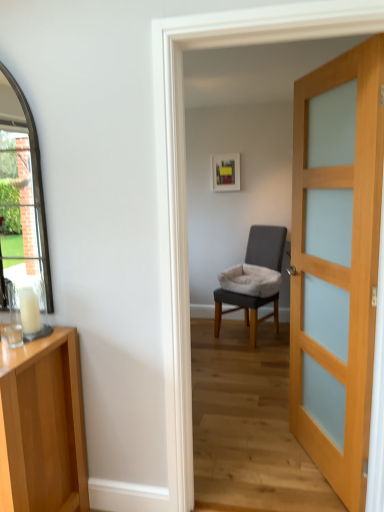
Measure the distance between point (x=339, y=308) and camera.

They are 6.54 feet apart.

Locate an element on the screen. Image resolution: width=384 pixels, height=512 pixels. gray fabric chair at center is located at coordinates (244, 310).

The height and width of the screenshot is (512, 384). Describe the element at coordinates (244, 310) in the screenshot. I see `gray fabric chair at center` at that location.

Identify the location of wooden door at right. (336, 262).

Which is more to the left, wooden door at right or gray fabric chair at center?

From the viewer's perspective, gray fabric chair at center appears more on the left side.

Based on the photo, from a real-world perspective, which object stands above the other?

wooden door at right, from a real-world perspective.

Is wooden door at right beside gray fabric chair at center?

No, wooden door at right is not beside gray fabric chair at center.

Is wooden door at right far from light wood cabinet at left?

Yes, wooden door at right and light wood cabinet at left are located far from each other.

Between wooden door at right and light wood cabinet at left, which one has less height?

light wood cabinet at left is shorter.

Is wooden door at right positioned in front of light wood cabinet at left?

No.

From a real-world perspective, which object stands above the other?

wooden door at right.

Does gray fabric chair at center appear on the left side of light wood cabinet at left?

No.

In terms of width, does gray fabric chair at center look wider or thinner when compared to light wood cabinet at left?

gray fabric chair at center is wider than light wood cabinet at left.

Which is less distant, (272, 251) or (34, 359)?

Point (34, 359)

From a real-world perspective, which is physically above, gray fabric chair at center or light wood cabinet at left?

gray fabric chair at center.

Does light wood cabinet at left have a smaller size compared to wooden door at right?

Actually, light wood cabinet at left might be larger than wooden door at right.

This screenshot has height=512, width=384. What are the coordinates of `door above the light wood cabinet at left (from a real-world perspective)` in the screenshot? It's located at (336, 262).

Is light wood cabinet at left to the left of wooden door at right from the viewer's perspective?

Indeed, light wood cabinet at left is positioned on the left side of wooden door at right.

Is light wood cabinet at left facing away from wooden door at right?

light wood cabinet at left is not turned away from wooden door at right.

Can you confirm if gray fabric chair at center is positioned to the left of wooden door at right?

Indeed, gray fabric chair at center is positioned on the left side of wooden door at right.

The image size is (384, 512). Identify the location of chair located underneath the wooden door at right (from a real-world perspective). (244, 310).

Which point is more forward, (x=263, y=234) or (x=322, y=330)?

Point (x=322, y=330)

Is light wood cabinet at left aimed at gray fabric chair at center?

No, light wood cabinet at left is not aimed at gray fabric chair at center.

Between light wood cabinet at left and gray fabric chair at center, which one is positioned in front?

light wood cabinet at left.

Considering the relative sizes of light wood cabinet at left and gray fabric chair at center in the image provided, is light wood cabinet at left thinner than gray fabric chair at center?

Yes, light wood cabinet at left is thinner than gray fabric chair at center.

Can you tell me how much light wood cabinet at left and gray fabric chair at center differ in facing direction?

There is a 26.8-degree angle between the facing directions of light wood cabinet at left and gray fabric chair at center.

Locate an element on the screen. chair located behind the wooden door at right is located at coordinates (244, 310).

I want to click on door above the light wood cabinet at left (from the image's perspective), so click(x=336, y=262).

Looking at the image, which one is located closer to wooden door at right, light wood cabinet at left or gray fabric chair at center?

Based on the image, light wood cabinet at left appears to be nearer to wooden door at right.

In the scene shown: Looking at the image, which one is located further to light wood cabinet at left, wooden door at right or gray fabric chair at center?

Among the two, gray fabric chair at center is located further to light wood cabinet at left.

From the image, which object appears to be nearer to light wood cabinet at left, gray fabric chair at center or wooden door at right?

The object closer to light wood cabinet at left is wooden door at right.

When comparing their distances from gray fabric chair at center, does light wood cabinet at left or wooden door at right seem further?

light wood cabinet at left.

Estimate the real-world distances between objects in this image. Which object is further from wooden door at right, gray fabric chair at center or light wood cabinet at left?

gray fabric chair at center.

Looking at the image, which one is located closer to gray fabric chair at center, wooden door at right or light wood cabinet at left?

wooden door at right is positioned closer to the anchor gray fabric chair at center.

Image resolution: width=384 pixels, height=512 pixels. I want to click on door between light wood cabinet at left and gray fabric chair at center from front to back, so click(x=336, y=262).